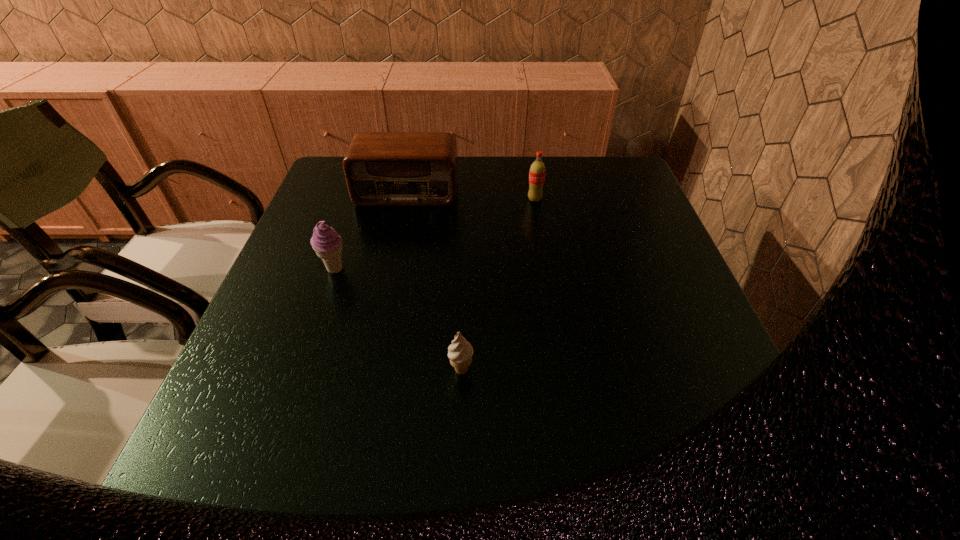
Choose which object is the third nearest neighbor to the shortest object. Please provide its 2D coordinates. Your answer should be formatted as a tuple, i.e. [(x, y)], where the tuple contains the x and y coordinates of a point satisfying the conditions above.

[(537, 171)]

At what (x,y) coordinates should I click in order to perform the action: click on the second closest object relative to the soda. Please return your answer as a coordinate pair (x, y). Looking at the image, I should click on (326, 242).

Image resolution: width=960 pixels, height=540 pixels. I want to click on vacant area in the image that satisfies the following two spatial constraints: 1. on the front panel of the soda; 2. on the right side of the radio receiver, so click(x=406, y=199).

At what (x,y) coordinates should I click in order to perform the action: click on free space that satisfies the following two spatial constraints: 1. on the front panel of the radio receiver; 2. on the left side of the soda. Please return your answer as a coordinate pair (x, y). The width and height of the screenshot is (960, 540). Looking at the image, I should click on (406, 199).